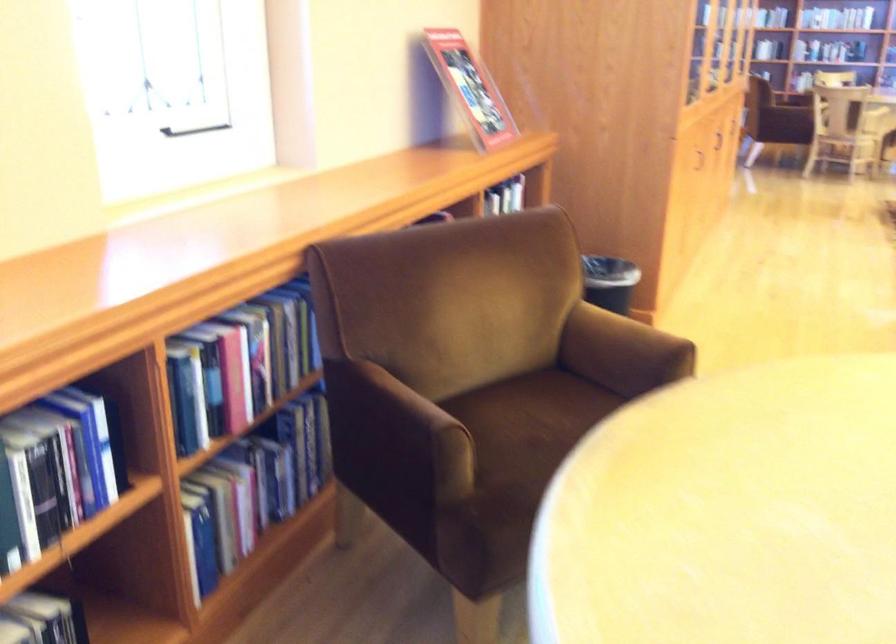
Locate an element on the screen. The width and height of the screenshot is (896, 644). brown chair sitting surface is located at coordinates (535, 426).